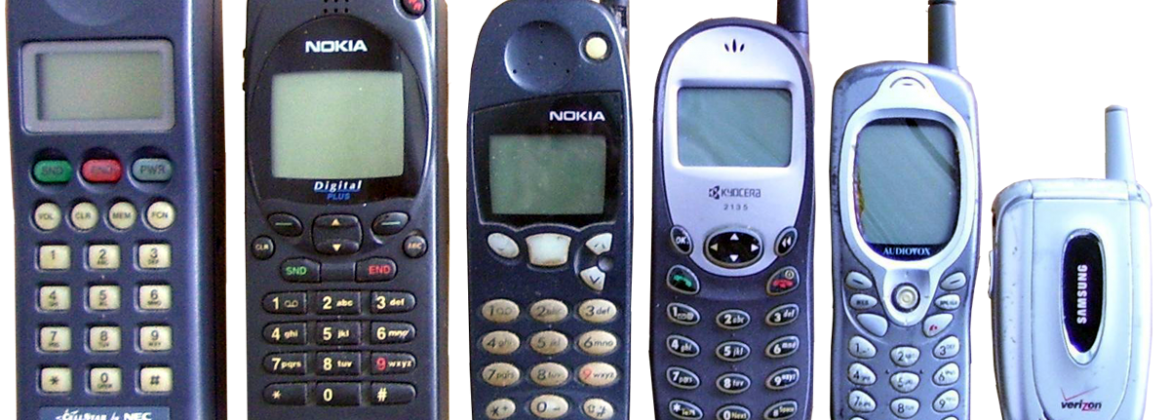
Locate an element on the screen. This screenshot has height=420, width=1170. screens is located at coordinates (879, 186), (759, 130), (566, 169), (374, 127), (138, 89).